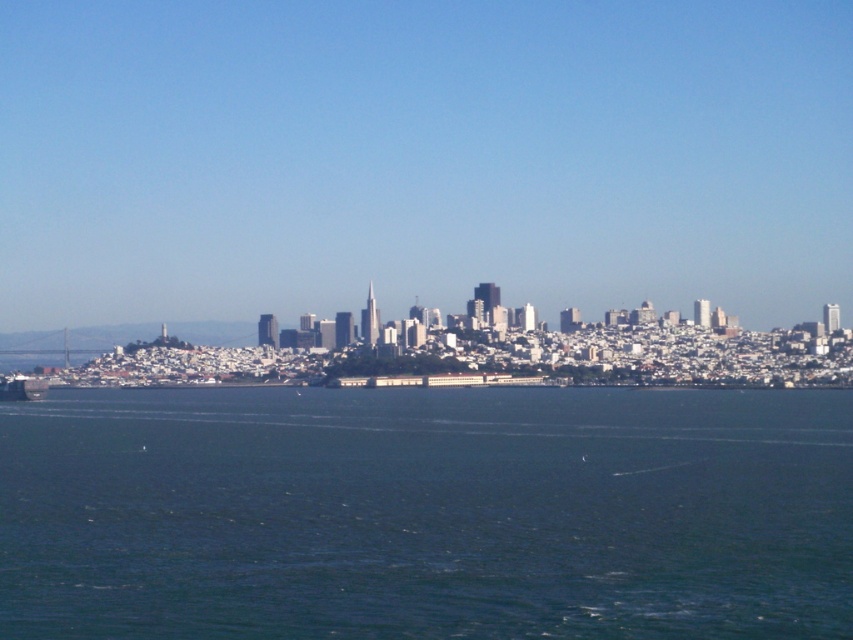
Question: Among these points, which one is farthest from the camera?

Choices:
 (A) (25, 392)
 (B) (67, 412)

Answer: (A)

Question: Which of the following is the farthest from the observer?

Choices:
 (A) (9, 397)
 (B) (627, 406)

Answer: (A)

Question: Among these points, which one is nearest to the camera?

Choices:
 (A) pos(471,440)
 (B) pos(39,387)

Answer: (A)

Question: Does blue liquid water at center have a lesser width compared to metallic gray ship at lower left?

Choices:
 (A) yes
 (B) no

Answer: (B)

Question: Can you confirm if blue liquid water at center is positioned above metallic gray ship at lower left?

Choices:
 (A) yes
 (B) no

Answer: (B)

Question: Is blue liquid water at center smaller than metallic gray ship at lower left?

Choices:
 (A) no
 (B) yes

Answer: (A)